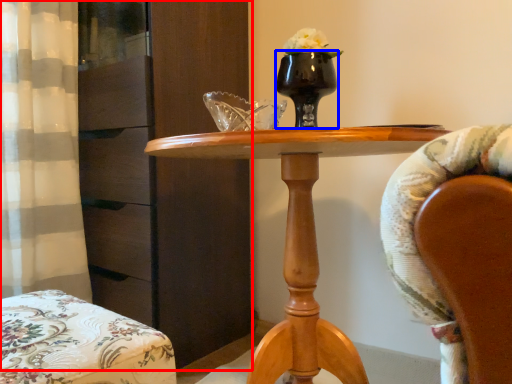
Question: Which point is further to the camera, dresser (highlighted by a red box) or vase (highlighted by a blue box)?

Choices:
 (A) dresser
 (B) vase

Answer: (A)